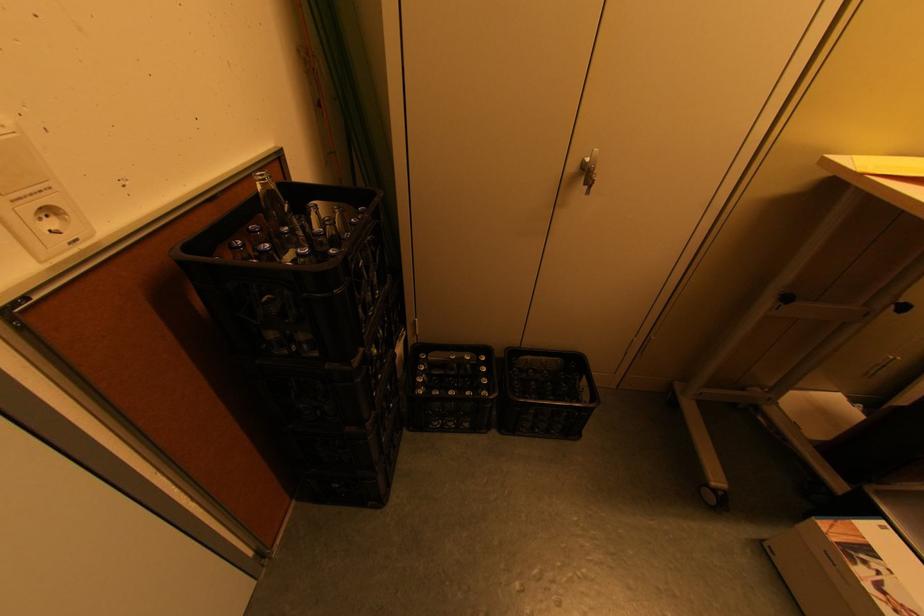
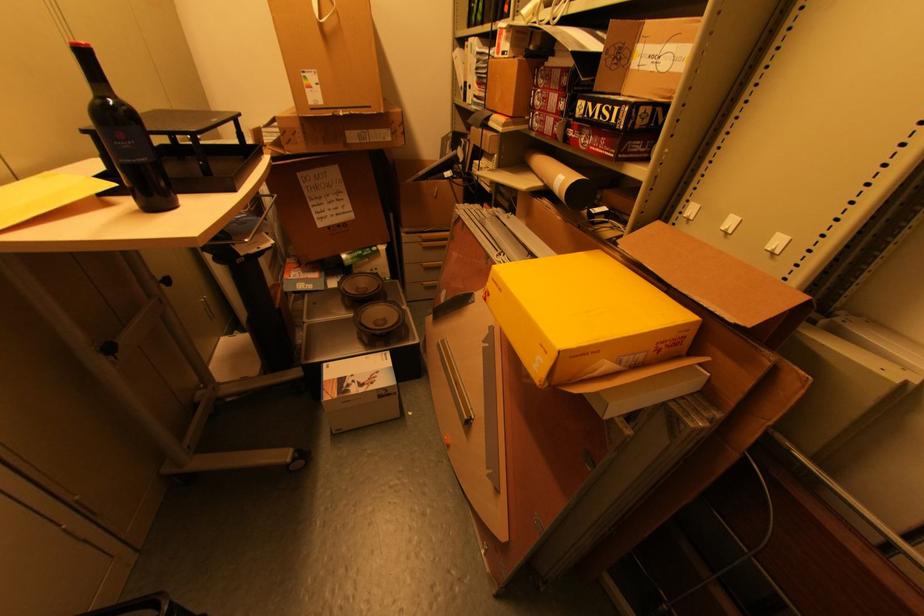
Where in the second image is the point corresponding to (894,358) from the first image?

(207, 301)